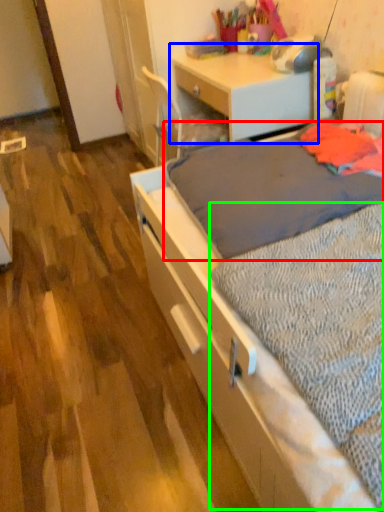
Question: Considering the real-world distances, which object is closest to blanket (highlighted by a red box)? desk (highlighted by a blue box) or sheet (highlighted by a green box).

Choices:
 (A) desk
 (B) sheet

Answer: (B)